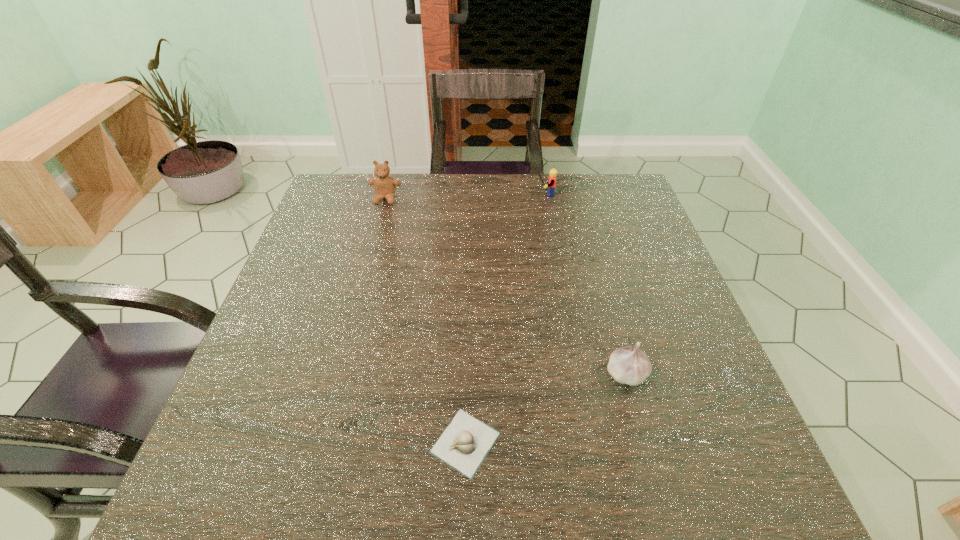
Identify the location of Lego. The height and width of the screenshot is (540, 960). (553, 173).

Image resolution: width=960 pixels, height=540 pixels. I want to click on teddy bear, so click(384, 185).

Identify the location of the taller garlic. Image resolution: width=960 pixels, height=540 pixels. pyautogui.click(x=628, y=365).

Find the location of a particular element. Image resolution: width=960 pixels, height=540 pixels. the farther garlic is located at coordinates (628, 365).

Locate an element on the screen. the shortest object is located at coordinates (464, 444).

Where is `the nearer garlic`? The image size is (960, 540). the nearer garlic is located at coordinates (464, 444).

This screenshot has height=540, width=960. In order to click on free spot located on the front-facing side of the Lego in this screenshot , I will do `click(489, 194)`.

What are the coordinates of `free spot located on the front-facing side of the Lego` in the screenshot? It's located at (398, 194).

At what (x,y) coordinates should I click in order to perform the action: click on vacant space located on the front-facing side of the Lego. Please return your answer as a coordinate pair (x, y). The width and height of the screenshot is (960, 540). Looking at the image, I should click on (495, 194).

At what (x,y) coordinates should I click in order to perform the action: click on free space located on the face of the teddy bear. Please return your answer as a coordinate pair (x, y). This screenshot has width=960, height=540. Looking at the image, I should click on (366, 273).